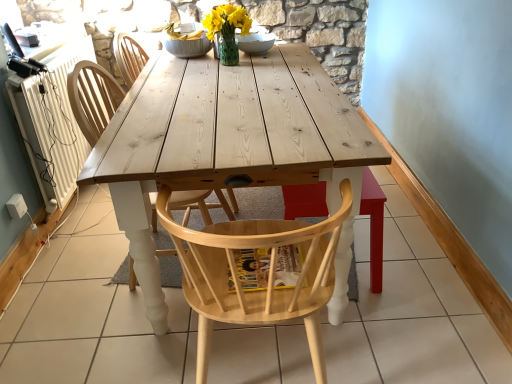
Question: Is the depth of polka dot glass vase at center greater than that of white ceramic bowl at center?

Choices:
 (A) yes
 (B) no

Answer: (B)

Question: Does polka dot glass vase at center turn towards white ceramic bowl at center?

Choices:
 (A) yes
 (B) no

Answer: (B)

Question: From the image's perspective, is polka dot glass vase at center under white ceramic bowl at center?

Choices:
 (A) yes
 (B) no

Answer: (A)

Question: Would you consider polka dot glass vase at center to be distant from white ceramic bowl at center?

Choices:
 (A) yes
 (B) no

Answer: (B)

Question: Can you confirm if polka dot glass vase at center is positioned to the left of white ceramic bowl at center?

Choices:
 (A) no
 (B) yes

Answer: (B)

Question: Is natural wood chair at center, the 3th chair viewed from the front, taller or shorter than white ceramic bowl at center?

Choices:
 (A) tall
 (B) short

Answer: (A)

Question: Is point (114, 44) positioned closer to the camera than point (257, 44)?

Choices:
 (A) farther
 (B) closer

Answer: (A)

Question: Considering their positions, is natural wood chair at center, the 1th chair when ordered from back to front, located in front of or behind white ceramic bowl at center?

Choices:
 (A) front
 (B) behind

Answer: (A)

Question: From the image's perspective, is natural wood chair at center, the 1th chair when ordered from back to front, located above or below white ceramic bowl at center?

Choices:
 (A) above
 (B) below

Answer: (B)

Question: Considering their positions, is natural wood chair at center, the 2th chair viewed from the back, located in front of or behind natural wood chair at center, the 3th chair viewed from the front?

Choices:
 (A) front
 (B) behind

Answer: (A)

Question: Is point (152, 205) positioned closer to the camera than point (128, 36)?

Choices:
 (A) farther
 (B) closer

Answer: (B)

Question: Which is correct: natural wood chair at center, the 2th chair viewed from the back, is inside natural wood chair at center, the 1th chair when ordered from back to front, or outside of it?

Choices:
 (A) outside
 (B) inside

Answer: (A)

Question: From the image's perspective, is natural wood chair at center, the 2th chair viewed from the back, located above or below natural wood chair at center, the 1th chair when ordered from back to front?

Choices:
 (A) below
 (B) above

Answer: (A)

Question: From the image's perspective, is natural wood chair at center, the 1th chair when ordered from back to front, above or below natural wood chair at center, the 2th chair viewed from the back?

Choices:
 (A) above
 (B) below

Answer: (A)

Question: From a real-world perspective, is natural wood chair at center, the 3th chair viewed from the front, physically located above or below natural wood chair at center, the 2th chair viewed from the back?

Choices:
 (A) below
 (B) above

Answer: (B)